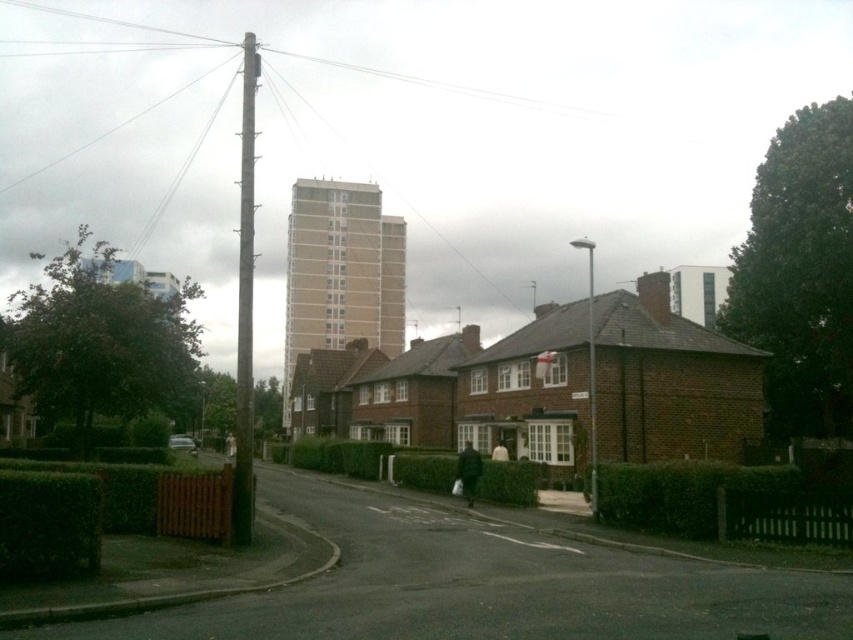
You are a delivery person who needs to avoid overhead wires. You see the smooth metallic pole at center and the silver metallic streetlight at center. Which object is closer to the left side of the road?

The smooth metallic pole at center is closer to the left side of the road because it is positioned to the left of the silver metallic streetlight at center.

You are a city planner assessing the width of the poles in the residential area. According to the city regulations, all poles must be at least 1 meter in width to support additional signage. Can you determine if the smooth metallic pole at center and the silver metallic streetlight at center meet this requirement based on their widths?

The smooth metallic pole at center might be wider than silver metallic streetlight at center, so it is possible that the smooth metallic pole at center meets the 1 meter width requirement, but the silver metallic streetlight at center may not. However, without exact measurements, we cannot be certain.